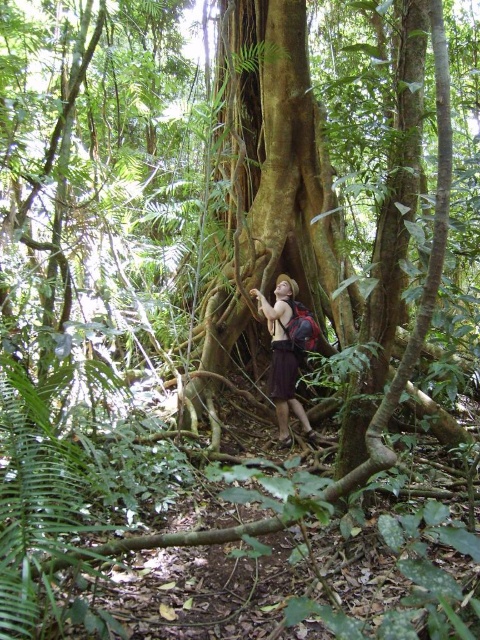
Question: In this image, where is green rough bark tree trunk at center located relative to brown fabric backpack at center?

Choices:
 (A) above
 (B) below

Answer: (A)

Question: Among these objects, which one is nearest to the camera?

Choices:
 (A) brown fabric backpack at center
 (B) green rough bark tree trunk at center

Answer: (B)

Question: Is green rough bark tree trunk at center positioned in front of brown fabric backpack at center?

Choices:
 (A) no
 (B) yes

Answer: (B)

Question: Which object is farther from the camera taking this photo?

Choices:
 (A) green rough bark tree trunk at center
 (B) brown fabric backpack at center

Answer: (B)

Question: Can you confirm if green rough bark tree trunk at center is positioned below brown fabric backpack at center?

Choices:
 (A) yes
 (B) no

Answer: (B)